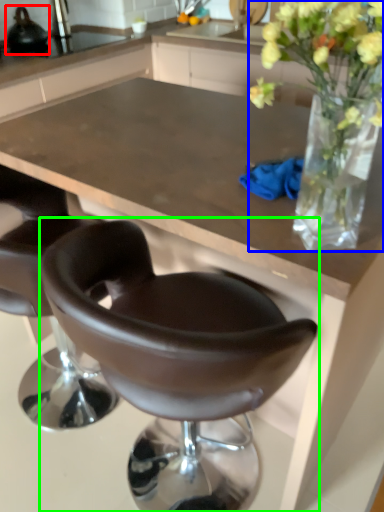
Question: Considering the real-world distances, which object is farthest from appliance (highlighted by a red box)? floral arrangement (highlighted by a blue box) or chair (highlighted by a green box)?

Choices:
 (A) floral arrangement
 (B) chair

Answer: (A)